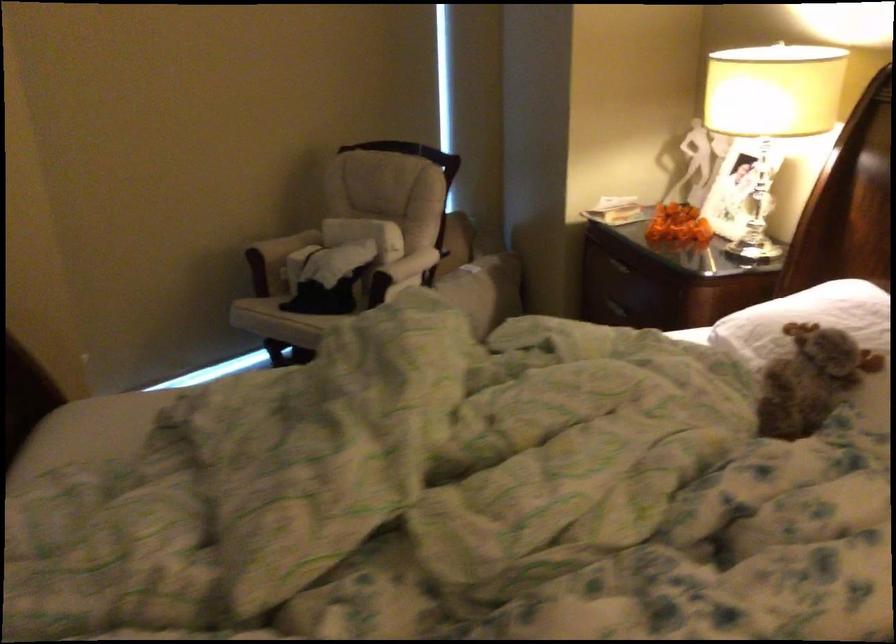
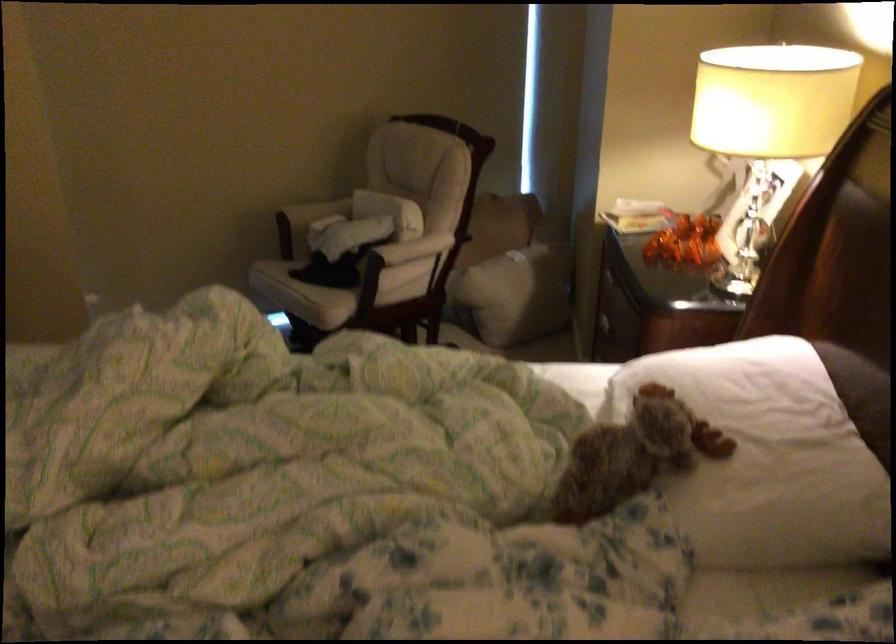
Question: How did the camera likely rotate?

Choices:
 (A) Left
 (B) Right
 (C) Up
 (D) Down

Answer: (A)